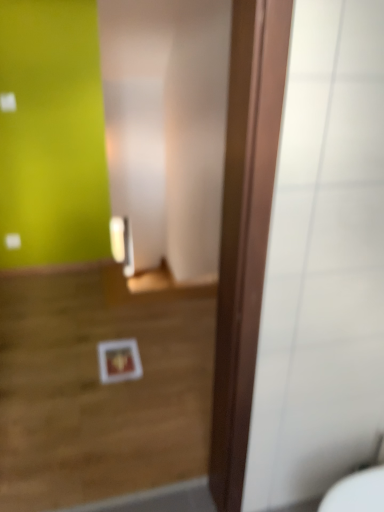
This screenshot has width=384, height=512. Describe the element at coordinates (359, 486) in the screenshot. I see `white glossy sink at lower right` at that location.

Identify the location of white glossy sink at lower right. (359, 486).

In order to click on white glossy sink at lower right in this screenshot , I will do `click(359, 486)`.